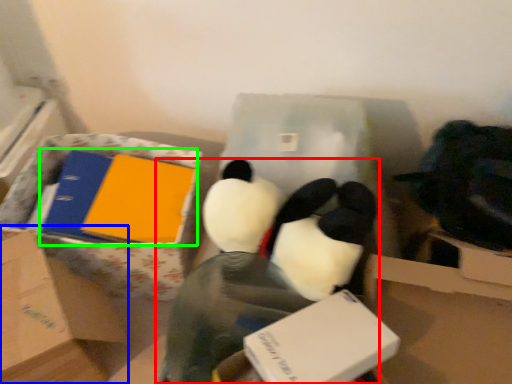
Question: Which object is positioned closest to toy (highlighted by a red box)? Select from box (highlighted by a blue box) and book (highlighted by a green box).

Choices:
 (A) box
 (B) book

Answer: (B)